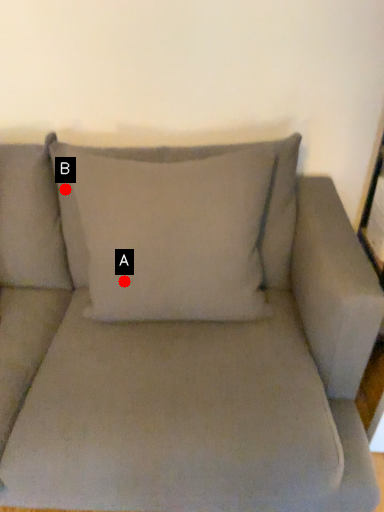
Question: Two points are circled on the image, labeled by A and B beside each circle. Among these points, which one is nearest to the camera?

Choices:
 (A) A is closer
 (B) B is closer

Answer: (A)